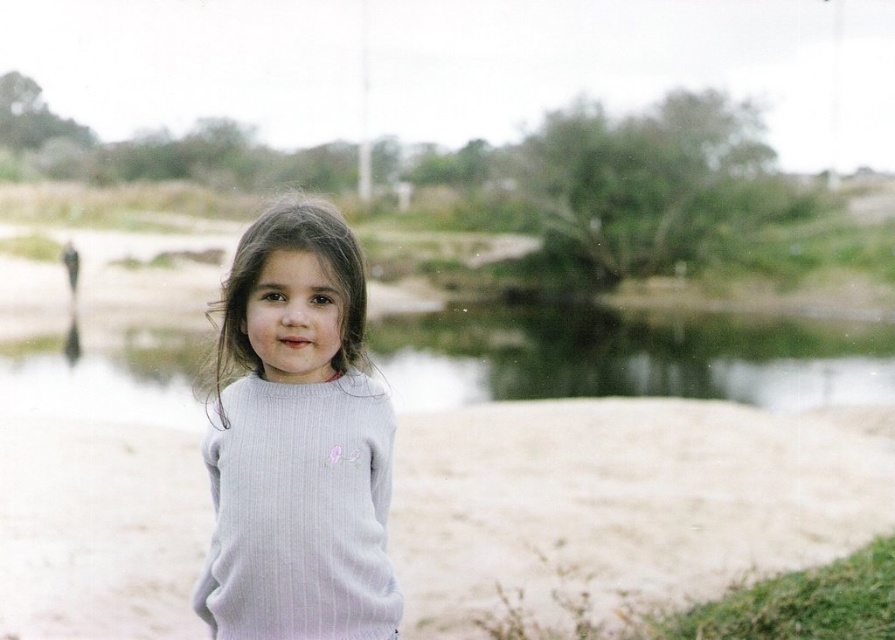
Can you confirm if white sand at center is taller than green water at center?

No, white sand at center is not taller than green water at center.

Can you confirm if white sand at center is positioned below green water at center?

Indeed, white sand at center is positioned under green water at center.

Where is `white sand at center`? The height and width of the screenshot is (640, 895). white sand at center is located at coordinates (624, 499).

I want to click on white sand at center, so click(x=624, y=499).

Is light gray ribbed sweater at center smaller than green water at center?

Indeed, light gray ribbed sweater at center has a smaller size compared to green water at center.

Does light gray ribbed sweater at center have a greater height compared to green water at center?

No.

This screenshot has height=640, width=895. Identify the location of light gray ribbed sweater at center. (297, 442).

Locate an element on the screen. white sand at center is located at coordinates (624, 499).

In the scene shown: Does white sand at center have a larger size compared to light gray ribbed sweater at center?

Indeed, white sand at center has a larger size compared to light gray ribbed sweater at center.

Between point (512, 532) and point (327, 436), which one is positioned in front?

Point (327, 436) is in front.

Locate an element on the screen. white sand at center is located at coordinates (624, 499).